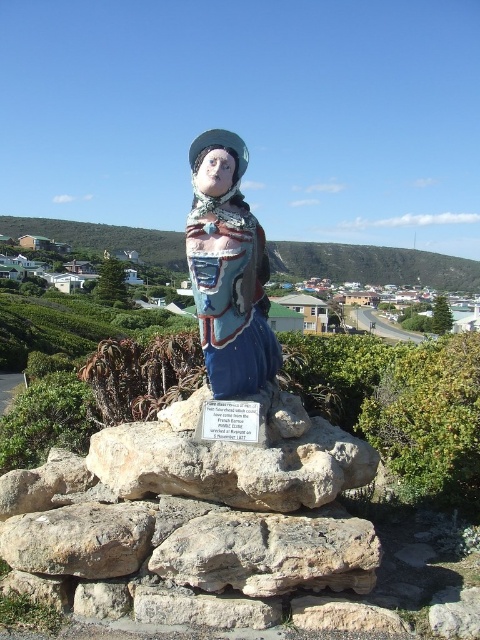
You are standing 5 feet away from the statue. Can you reach the point at coordinates point (x=64, y=518) without moving closer to the statue?

The distance of point (x=64, y=518) from viewer is 6.44 feet, so you are currently 5 feet away from the statue. Since 5 feet is less than 6.44 feet, you can reach the point at coordinates point (x=64, y=518) without moving closer to the statue.

From the picture: You are an artist planning to create a miniature version of the scene. You need to know the relative sizes of the gray rock at center and the painted ceramic statue at center. Which one should you make larger in your model?

The gray rock at center is bigger than the painted ceramic statue at center, so you should make the gray rock at center larger in your model.

You are standing in front of the statue and want to place a small flower bouquet at the exact location of point (79,540). What object will the bouquet be placed on?

The bouquet will be placed on the brown rough rock at lower left located at point (79,540).